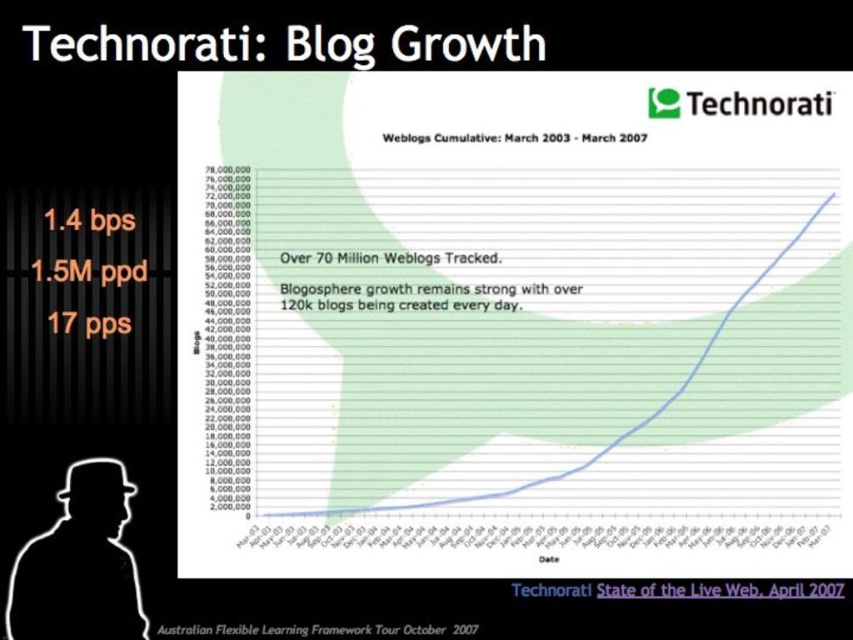
Can you confirm if white gridlines at bottom is positioned below orange text at left?

Indeed, white gridlines at bottom is positioned under orange text at left.

Does white gridlines at bottom have a larger size compared to orange text at left?

Yes, white gridlines at bottom is bigger than orange text at left.

Who is more distant from viewer, (788, 529) or (39, 275)?

Positioned behind is point (788, 529).

Identify the location of white gridlines at bottom. The image size is (853, 640). (532, 536).

Measure the distance between point (125, 280) and camera.

4.73 feet

Which is in front, point (108, 225) or point (625, 140)?

Point (108, 225) is more forward.

Describe the element at coordinates (90, 269) in the screenshot. I see `orange text at left` at that location.

Identify the location of orange text at left. (90, 269).

Can you confirm if white paper at center is positioned below white text at upper center?

Correct, white paper at center is located below white text at upper center.

Who is more forward, (352, 252) or (641, 132)?

Point (641, 132) is in front.

Between point (383, 284) and point (585, 140), which one is positioned behind?

Point (383, 284)

Locate an element on the screen. Image resolution: width=853 pixels, height=640 pixels. white paper at center is located at coordinates click(397, 276).